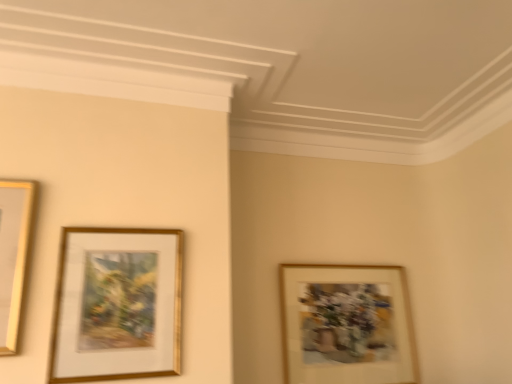
Question: From the image's perspective, is wooden picture frame at lower right, placed as the first picture frame when sorted from back to front, above or below gold/glossy picture frame at lower left, the 1th picture frame from the front?

Choices:
 (A) below
 (B) above

Answer: (A)

Question: Considering the positions of wooden picture frame at lower right, the 2th picture frame from the left, and gold/glossy picture frame at lower left, the 1th picture frame from the front, in the image, is wooden picture frame at lower right, the 2th picture frame from the left, taller or shorter than gold/glossy picture frame at lower left, the 1th picture frame from the front,?

Choices:
 (A) tall
 (B) short

Answer: (A)

Question: From a real-world perspective, is wooden picture frame at lower right, positioned as the 1th picture frame in right-to-left order, positioned above or below gold/glossy picture frame at lower left, which is the first picture frame in left-to-right order?

Choices:
 (A) above
 (B) below

Answer: (B)

Question: In terms of width, does gold/glossy picture frame at lower left, which is the first picture frame in left-to-right order, look wider or thinner when compared to wooden picture frame at lower right, which appears as the 2th picture frame when viewed from the front?

Choices:
 (A) thin
 (B) wide

Answer: (A)

Question: Visually, is gold/glossy picture frame at lower left, the 2th picture frame in the back-to-front sequence, positioned to the left or to the right of wooden picture frame at lower right, the 2th picture frame from the left?

Choices:
 (A) left
 (B) right

Answer: (A)

Question: Which is correct: gold/glossy picture frame at lower left, the 2th picture frame from the right, is inside wooden picture frame at lower right, positioned as the 1th picture frame in right-to-left order, or outside of it?

Choices:
 (A) outside
 (B) inside

Answer: (A)

Question: Considering the positions of gold/glossy picture frame at lower left, the 1th picture frame from the front, and wooden picture frame at lower right, the 2th picture frame from the left, in the image, is gold/glossy picture frame at lower left, the 1th picture frame from the front, taller or shorter than wooden picture frame at lower right, the 2th picture frame from the left,?

Choices:
 (A) tall
 (B) short

Answer: (B)